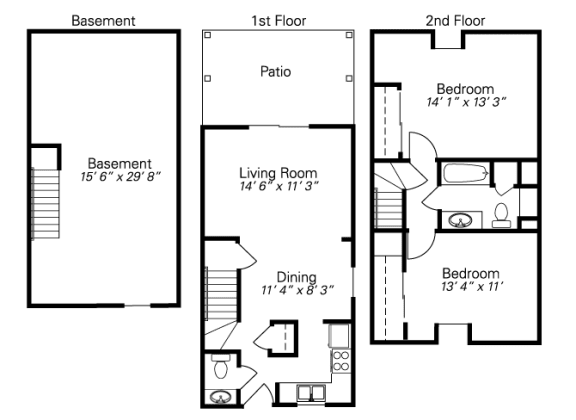
Where is `rooms`? The image size is (576, 420). rooms is located at coordinates (109, 174), (249, 179), (317, 277), (452, 279), (465, 114), (481, 199), (301, 368).